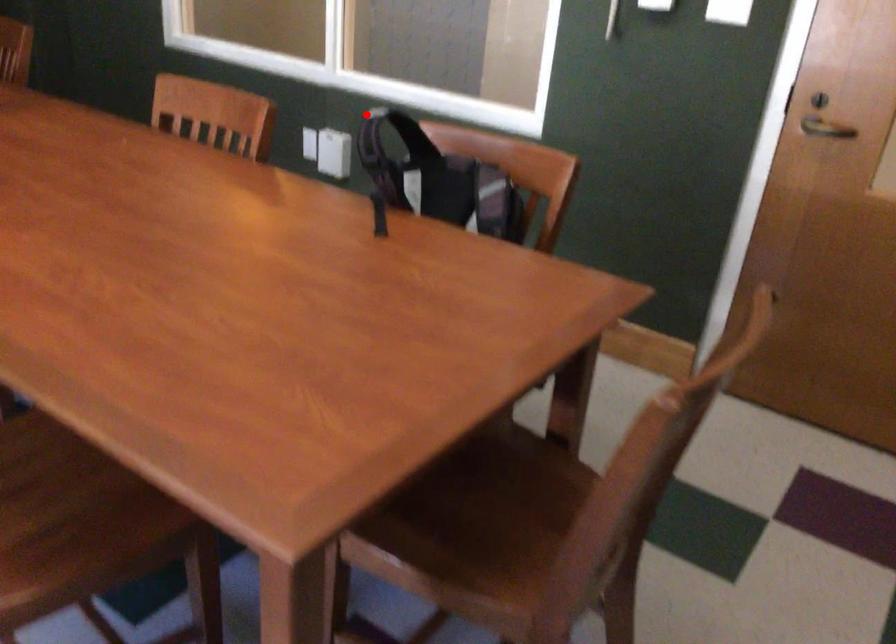
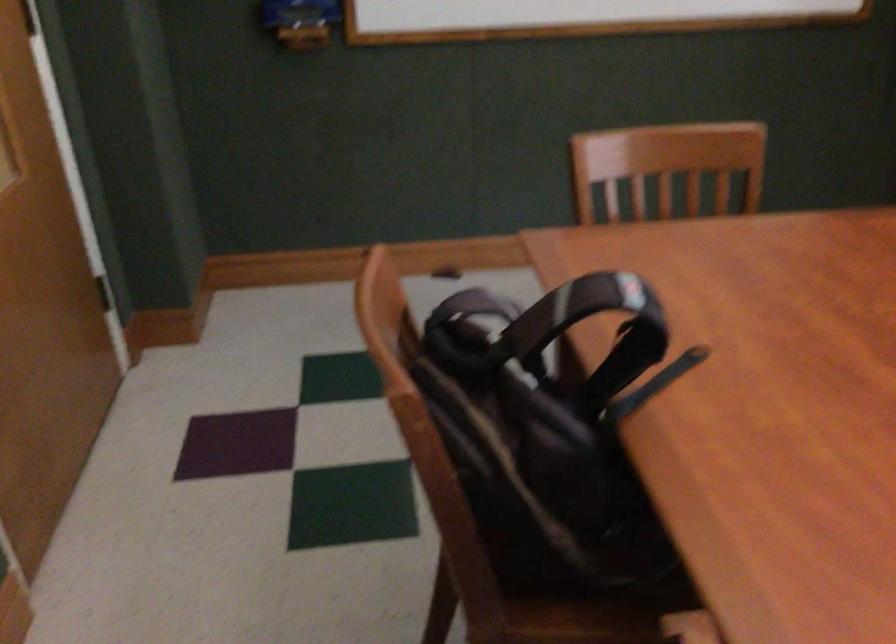
Where in the second image is the point corresponding to the highlighted location from the first image?

(625, 297)